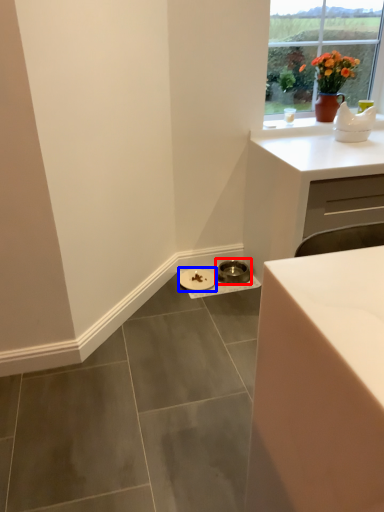
Question: Which of the following is the closest to the observer, manhole cover (highlighted by a red box) or manhole cover (highlighted by a blue box)?

Choices:
 (A) manhole cover
 (B) manhole cover

Answer: (B)